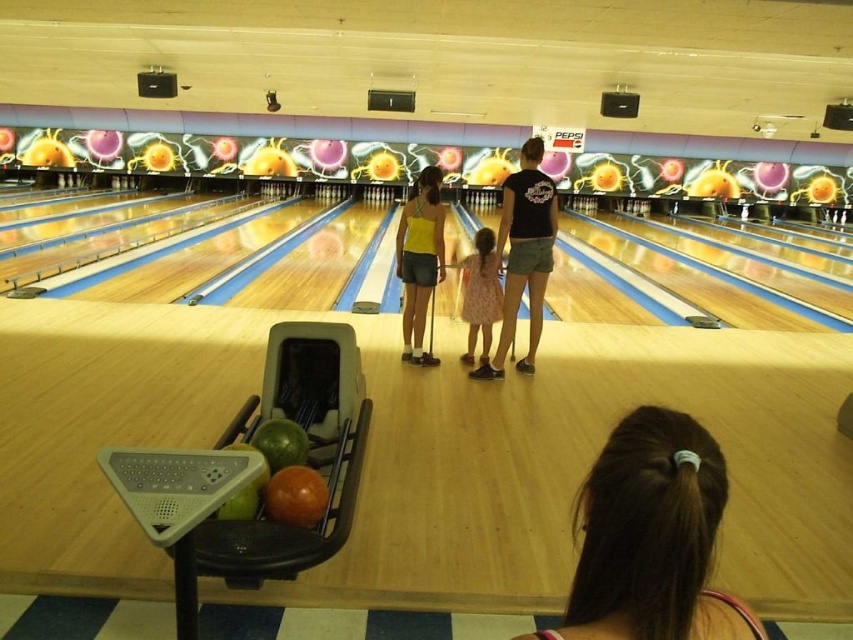
Question: Is brown hair at center wider than dress fabric at center?

Choices:
 (A) yes
 (B) no

Answer: (B)

Question: Can you confirm if yellow matte tank top at center is thinner than dress fabric at center?

Choices:
 (A) no
 (B) yes

Answer: (A)

Question: Which point appears farthest from the camera in this image?

Choices:
 (A) (601, 484)
 (B) (419, 228)

Answer: (B)

Question: Which is nearer to the yellow matte tank top at center?

Choices:
 (A) dress fabric at center
 (B) brown hair at center
 (C) matte black shirt at center

Answer: (A)

Question: Where is brown hair at center located in relation to dress fabric at center in the image?

Choices:
 (A) above
 (B) below

Answer: (B)

Question: Which object appears closest to the camera in this image?

Choices:
 (A) matte black shirt at center
 (B) yellow matte tank top at center
 (C) brown hair at center

Answer: (C)